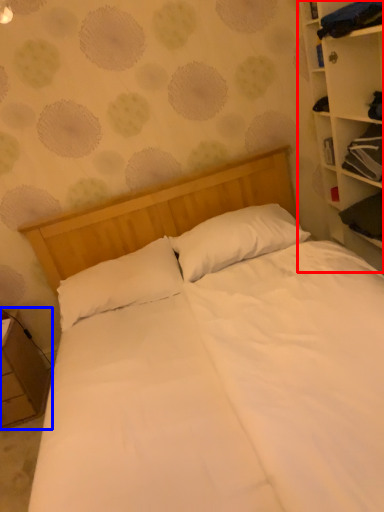
Question: Which point is closer to the camera, bookcase (highlighted by a red box) or nightstand (highlighted by a blue box)?

Choices:
 (A) bookcase
 (B) nightstand

Answer: (A)